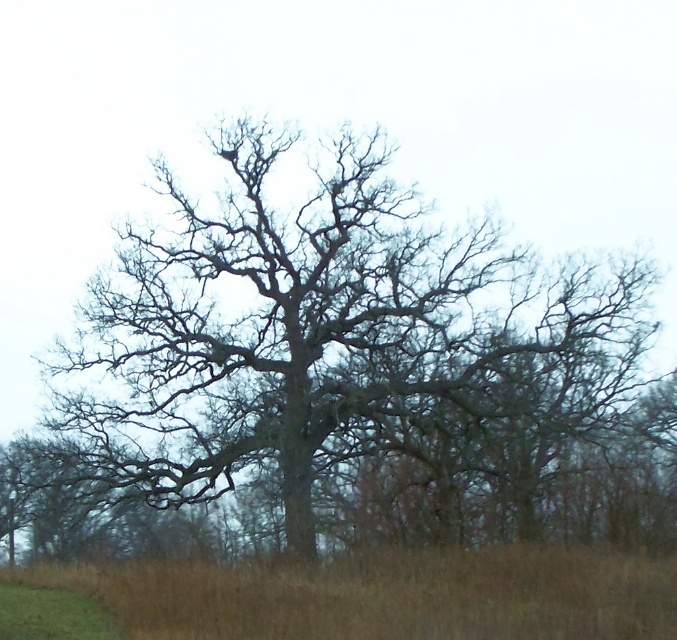
Does bare wood tree at center have a larger size compared to brown grass at lower center?

Yes.

Consider the image. Is bare wood tree at center thinner than brown grass at lower center?

In fact, bare wood tree at center might be wider than brown grass at lower center.

Is point (341, 211) closer to viewer compared to point (336, 609)?

No, (341, 211) is behind (336, 609).

At what (x,y) coordinates should I click in order to perform the action: click on bare wood tree at center. Please return your answer as a coordinate pair (x, y). Looking at the image, I should click on (353, 374).